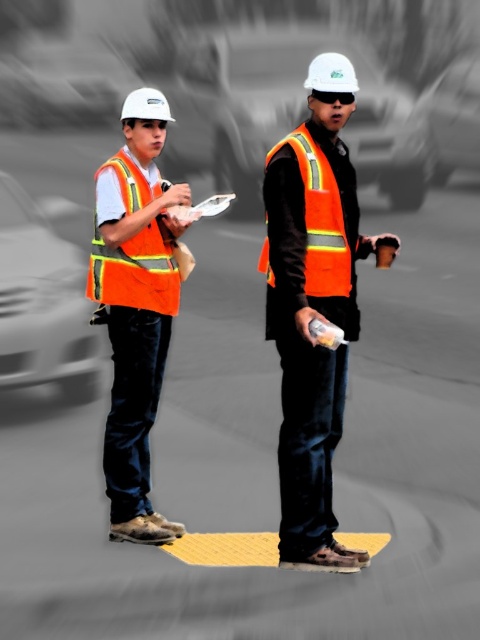
You are a safety inspector at the construction site. You see two points marked on the ground at coordinates point (357,161) and point (64,316). According to safety regulations, workers must avoid standing behind any marked points. Are you currently standing in a safe position?

Point (357,161) is behind point (64,316). Since you must avoid standing behind any marked points, if you are positioned behind point (64,316), you would also be behind point (357,161). To determine safety, ensure you are not behind either point. However, without knowing your exact position, it cannot be confirmed. Please check your location relative to both points.

You are a safety inspector who needs to ensure that the metallic silver car at center is not blocking the orange reflective vest at left. Based on the image, is the car currently obstructing the vest?

The metallic silver car at center is positioned over orange reflective vest at left, so yes, the car is obstructing the vest.